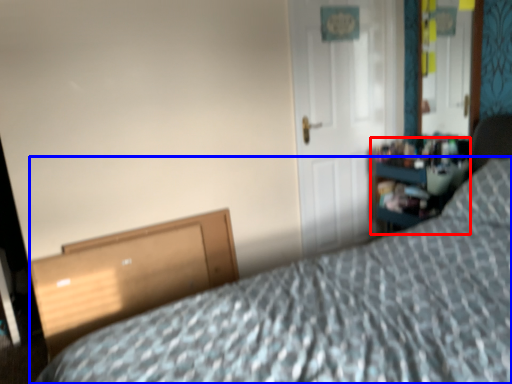
Question: Which point is closer to the camera, dresser (highlighted by a red box) or bed (highlighted by a blue box)?

Choices:
 (A) dresser
 (B) bed

Answer: (B)